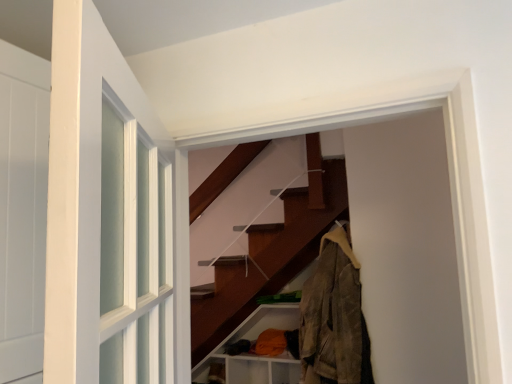
Question: Is brown matte shelf at lower center wider than orange fabric at lower right?

Choices:
 (A) yes
 (B) no

Answer: (B)

Question: From a real-world perspective, is brown matte shelf at lower center below orange fabric at lower right?

Choices:
 (A) no
 (B) yes

Answer: (B)

Question: Is brown matte shelf at lower center with orange fabric at lower right?

Choices:
 (A) yes
 (B) no

Answer: (B)

Question: Is the depth of brown matte shelf at lower center greater than that of orange fabric at lower right?

Choices:
 (A) yes
 (B) no

Answer: (A)

Question: Does brown matte shelf at lower center appear on the left side of orange fabric at lower right?

Choices:
 (A) yes
 (B) no

Answer: (A)

Question: Does brown matte shelf at lower center have a lesser height compared to orange fabric at lower right?

Choices:
 (A) no
 (B) yes

Answer: (B)

Question: Is camouflage fabric jacket at right next to brown matte shelf at lower center?

Choices:
 (A) no
 (B) yes

Answer: (A)

Question: Considering the relative sizes of camouflage fabric jacket at right and brown matte shelf at lower center in the image provided, is camouflage fabric jacket at right taller than brown matte shelf at lower center?

Choices:
 (A) no
 (B) yes

Answer: (B)

Question: From the image's perspective, is camouflage fabric jacket at right located beneath brown matte shelf at lower center?

Choices:
 (A) yes
 (B) no

Answer: (B)

Question: Is there a large distance between camouflage fabric jacket at right and brown matte shelf at lower center?

Choices:
 (A) no
 (B) yes

Answer: (B)

Question: Can we say camouflage fabric jacket at right lies outside brown matte shelf at lower center?

Choices:
 (A) no
 (B) yes

Answer: (B)

Question: Does camouflage fabric jacket at right have a lesser width compared to brown matte shelf at lower center?

Choices:
 (A) yes
 (B) no

Answer: (B)

Question: From the image's perspective, would you say orange fabric at lower right is positioned over camouflage fabric jacket at right?

Choices:
 (A) no
 (B) yes

Answer: (A)